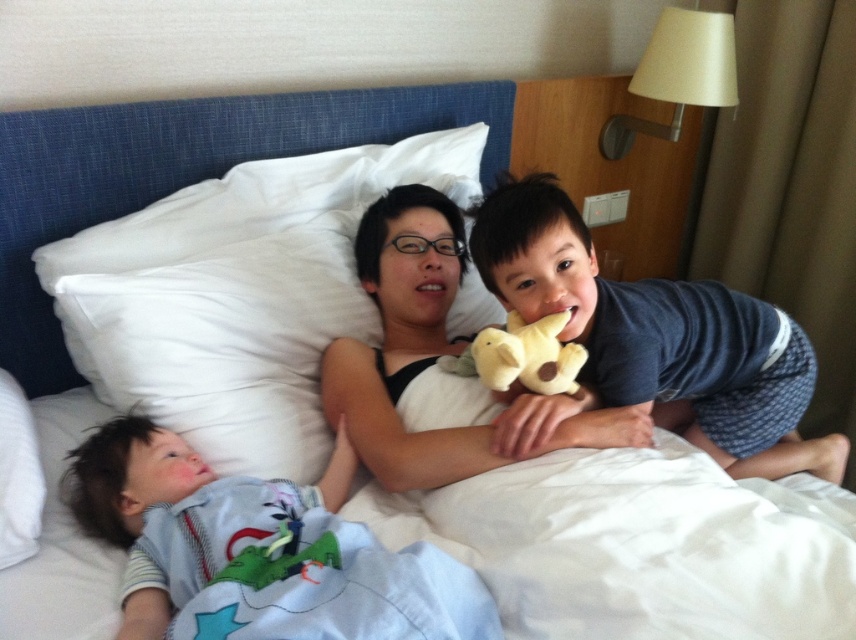
You are taking a photo of the scene and want to focus on both the point at point (238, 246) and point (282, 595). Since the camera can only focus on one depth at a time, which point should you focus on to ensure the closer point is sharp?

You should focus on point (238, 246) because it is closer to the camera than point (282, 595), ensuring the closer point remains sharp.

You are a photographer taking a picture of the dark blue cotton shirt at upper right. The camera is positioned at the point with coordinates (651, 342). Can you confirm if the camera is pointing directly at the dark blue cotton shirt at upper right?

Yes, the camera is positioned at point (651, 342) which directly indicates the location of the dark blue cotton shirt at upper right, so the camera is pointing directly at it.

You are a photographer trying to capture a candid shot of the light blue cotton shirt at lower left and dark blue cotton shirt at upper right. Since you want both shirts to be in focus, you need to adjust your camera settings. Which shirt is closer to the camera so you can set the focal point accordingly?

The light blue cotton shirt at lower left is shorter than dark blue cotton shirt at upper right, so the light blue cotton shirt at lower left is closer to the camera.